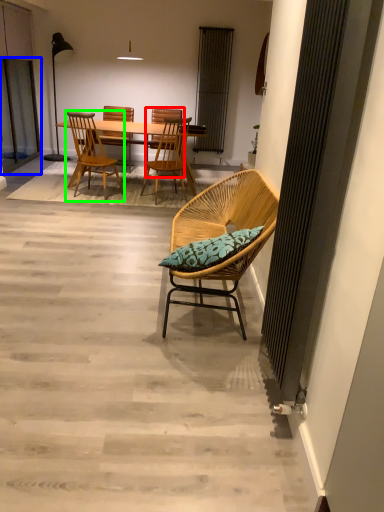
Question: Which object is positioned closest to beach chair (highlighted by a red box)? Select from screen door (highlighted by a blue box) and chair (highlighted by a green box).

Choices:
 (A) screen door
 (B) chair

Answer: (B)